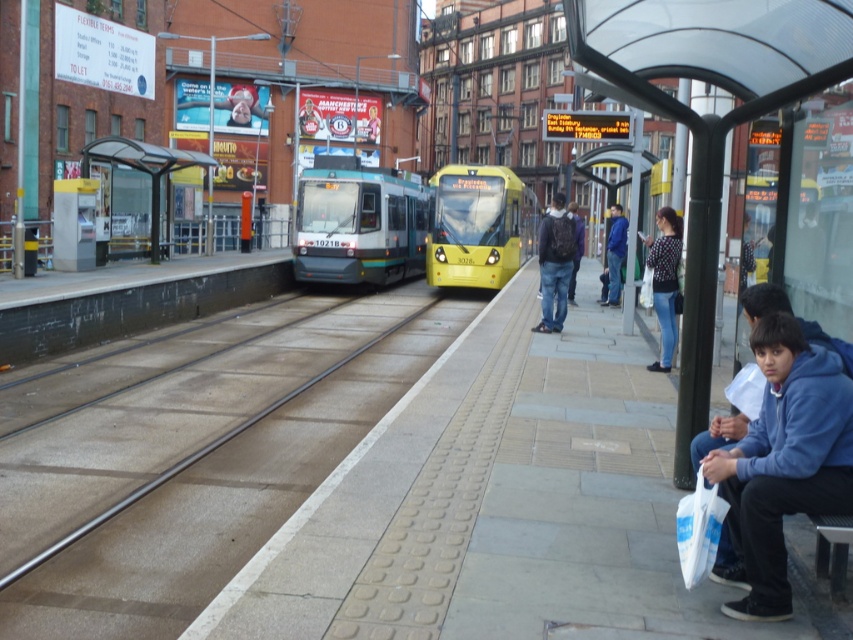
Between yellow matte train at center and blue jacket at center, which one appears on the right side from the viewer's perspective?

blue jacket at center is more to the right.

Image resolution: width=853 pixels, height=640 pixels. Find the location of `yellow matte train at center`. yellow matte train at center is located at coordinates point(479,225).

Locate an element on the screen. The width and height of the screenshot is (853, 640). yellow matte train at center is located at coordinates (479, 225).

Find the location of a particular element. The image size is (853, 640). dark blue jeans at center is located at coordinates (554, 264).

Who is more forward, (556, 225) or (665, 362)?

Point (665, 362)

The width and height of the screenshot is (853, 640). What do you see at coordinates (554, 264) in the screenshot?
I see `dark blue jeans at center` at bounding box center [554, 264].

At what (x,y) coordinates should I click in order to perform the action: click on dark blue jeans at center. Please return your answer as a coordinate pair (x, y). Looking at the image, I should click on (554, 264).

Is blue fleece jacket at lower right below yellow matte train at center?

Correct, blue fleece jacket at lower right is located below yellow matte train at center.

Who is shorter, blue fleece jacket at lower right or yellow matte train at center?

blue fleece jacket at lower right is shorter.

Who is more forward, (x=735, y=464) or (x=439, y=218)?

Point (x=735, y=464) is more forward.

At what (x,y) coordinates should I click in order to perform the action: click on blue fleece jacket at lower right. Please return your answer as a coordinate pair (x, y). Looking at the image, I should click on (782, 464).